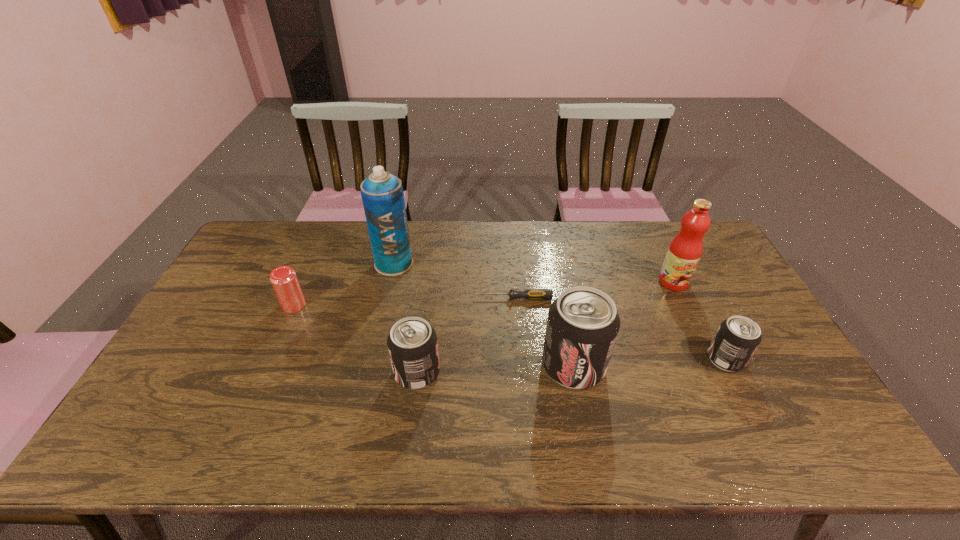
At what (x,y) coordinates should I click in order to perform the action: click on vacant spot to place a soda can on the left. Please return your answer as a coordinate pair (x, y). This screenshot has height=540, width=960. Looking at the image, I should click on (256, 380).